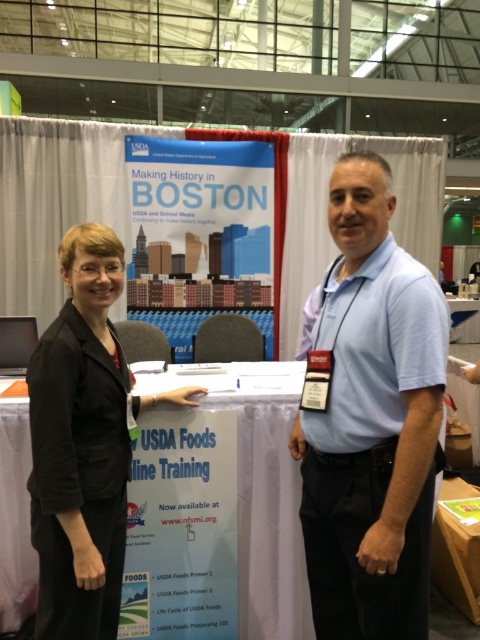
Who is shorter, light blue shirt at center or black fabric suit at left?

With less height is black fabric suit at left.

Between point (359, 362) and point (112, 365), which one is positioned in front?

Point (359, 362) is more forward.

Is point (342, 470) farther from camera compared to point (45, 452)?

That is True.

I want to click on light blue shirt at center, so click(x=371, y=419).